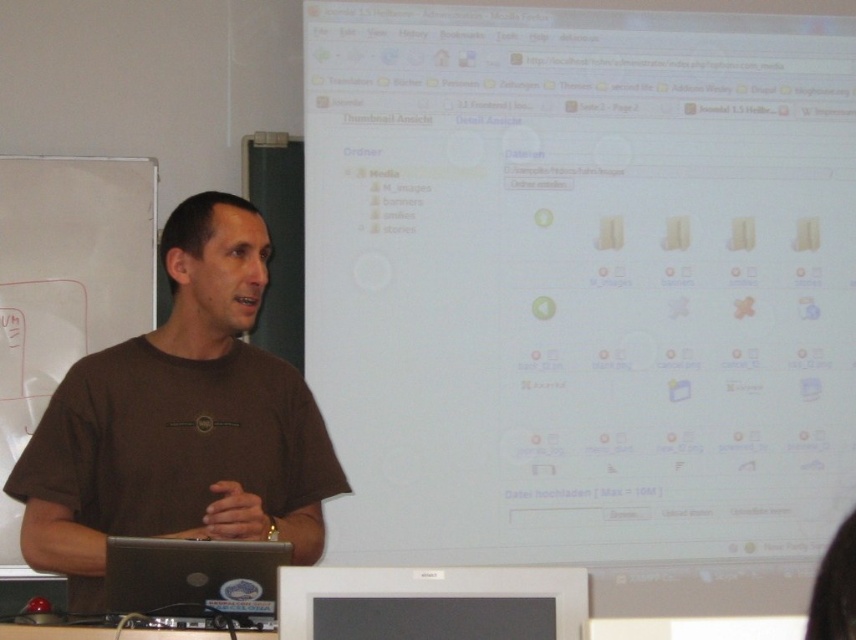
Question: Estimate the real-world distances between objects in this image. Which object is farther from the black glossy monitor at lower center?

Choices:
 (A) black plastic laptop at lower left
 (B) brown cotton shirt at center

Answer: (B)

Question: Is black glossy monitor at lower center positioned behind black plastic laptop at lower left?

Choices:
 (A) yes
 (B) no

Answer: (B)

Question: Estimate the real-world distances between objects in this image. Which object is farther from the white glossy screen at upper center?

Choices:
 (A) brown cotton shirt at center
 (B) black plastic laptop at lower left

Answer: (B)

Question: Observing the image, what is the correct spatial positioning of brown cotton shirt at center in reference to black glossy monitor at lower center?

Choices:
 (A) above
 (B) below

Answer: (A)

Question: Which object is closer to the camera taking this photo?

Choices:
 (A) black glossy monitor at lower center
 (B) brown cotton shirt at center

Answer: (A)

Question: Is black glossy monitor at lower center above black plastic laptop at lower left?

Choices:
 (A) no
 (B) yes

Answer: (B)